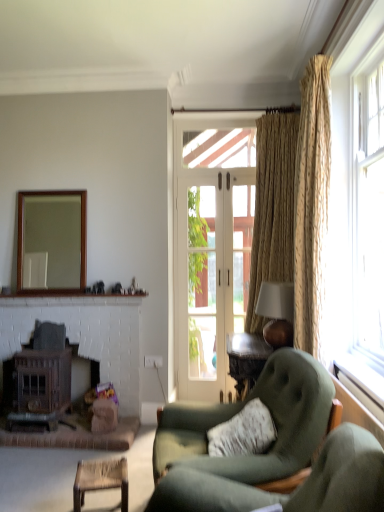
Question: Does wooden frame mirror at upper left have a smaller size compared to clear glass door at center?

Choices:
 (A) no
 (B) yes

Answer: (B)

Question: Is wooden frame mirror at upper left placed right next to clear glass door at center?

Choices:
 (A) no
 (B) yes

Answer: (A)

Question: From a real-world perspective, does wooden frame mirror at upper left stand above clear glass door at center?

Choices:
 (A) yes
 (B) no

Answer: (A)

Question: Is wooden frame mirror at upper left positioned beyond the bounds of clear glass door at center?

Choices:
 (A) no
 (B) yes

Answer: (B)

Question: From a real-world perspective, is wooden frame mirror at upper left located beneath clear glass door at center?

Choices:
 (A) no
 (B) yes

Answer: (A)

Question: From the image's perspective, is translucent glass window at right positioned above or below dark brown wood fireplace at lower left?

Choices:
 (A) above
 (B) below

Answer: (A)

Question: Is translucent glass window at right wider or thinner than dark brown wood fireplace at lower left?

Choices:
 (A) thin
 (B) wide

Answer: (B)

Question: Is translucent glass window at right taller or shorter than dark brown wood fireplace at lower left?

Choices:
 (A) short
 (B) tall

Answer: (B)

Question: Based on their sizes in the image, would you say translucent glass window at right is bigger or smaller than dark brown wood fireplace at lower left?

Choices:
 (A) small
 (B) big

Answer: (B)

Question: Considering their positions, is gold textured curtain at right, which is counted as the 2th curtain, starting from the back, located in front of or behind translucent glass window at right?

Choices:
 (A) front
 (B) behind

Answer: (B)

Question: Is point (316, 77) positioned closer to the camera than point (344, 216)?

Choices:
 (A) closer
 (B) farther

Answer: (A)

Question: Looking at the image, does gold textured curtain at right, arranged as the first curtain when viewed from the front, seem bigger or smaller compared to translucent glass window at right?

Choices:
 (A) big
 (B) small

Answer: (B)

Question: Based on their positions, is gold textured curtain at right, arranged as the first curtain when viewed from the front, located to the left or right of translucent glass window at right?

Choices:
 (A) right
 (B) left

Answer: (B)

Question: Considering the positions of rattan chair at lower left and suede green armchair at lower right in the image, is rattan chair at lower left bigger or smaller than suede green armchair at lower right?

Choices:
 (A) big
 (B) small

Answer: (B)

Question: Is rattan chair at lower left to the left or to the right of suede green armchair at lower right in the image?

Choices:
 (A) left
 (B) right

Answer: (A)